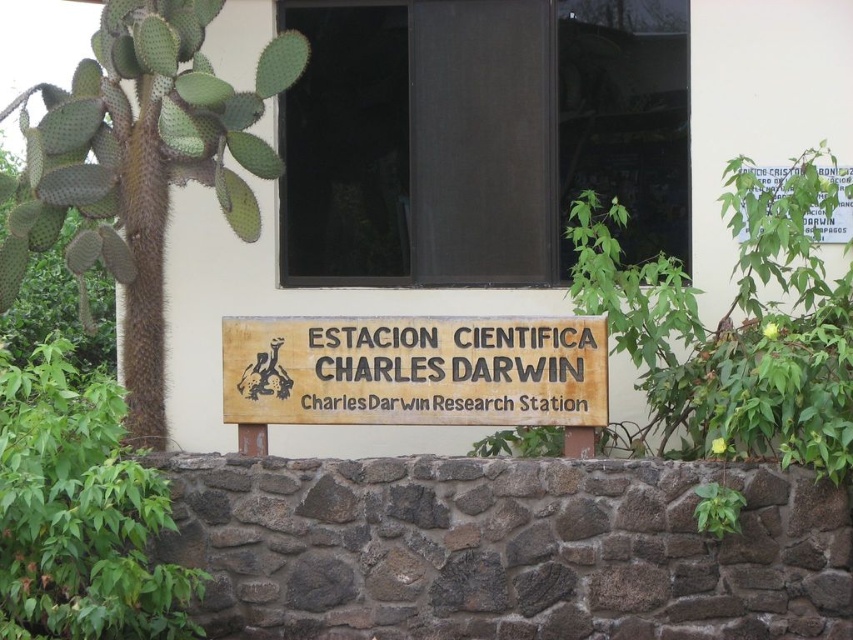
Question: Does green spiny cactus at left appear on the right side of wooden sign at center?

Choices:
 (A) yes
 (B) no

Answer: (B)

Question: Can you confirm if green spiny cactus at left is positioned to the right of white paper sign at upper right?

Choices:
 (A) no
 (B) yes

Answer: (A)

Question: Which point is farther to the camera?

Choices:
 (A) (47, 196)
 (B) (842, 208)
 (C) (363, 394)

Answer: (B)

Question: Which of the following is the farthest from the observer?

Choices:
 (A) (148, 120)
 (B) (785, 193)

Answer: (B)

Question: Can you confirm if green spiny cactus at left is positioned to the right of white paper sign at upper right?

Choices:
 (A) no
 (B) yes

Answer: (A)

Question: Estimate the real-world distances between objects in this image. Which object is closer to the white paper sign at upper right?

Choices:
 (A) wooden sign at center
 (B) green spiny cactus at left

Answer: (A)